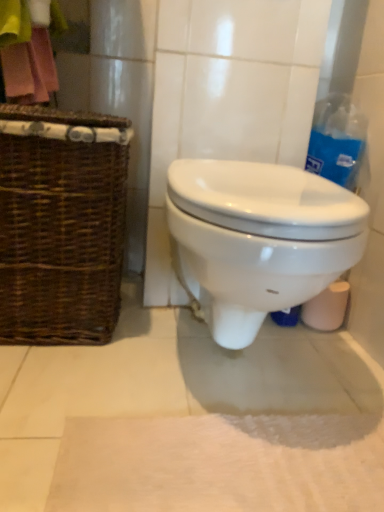
Question: Does brown woven picnic basket at left contain white soft bath mat at lower center?

Choices:
 (A) no
 (B) yes

Answer: (A)

Question: Is brown woven picnic basket at left thinner than white soft bath mat at lower center?

Choices:
 (A) yes
 (B) no

Answer: (B)

Question: Considering the relative sizes of brown woven picnic basket at left and white soft bath mat at lower center in the image provided, is brown woven picnic basket at left shorter than white soft bath mat at lower center?

Choices:
 (A) no
 (B) yes

Answer: (A)

Question: Is brown woven picnic basket at left facing towards white soft bath mat at lower center?

Choices:
 (A) yes
 (B) no

Answer: (B)

Question: Can you confirm if brown woven picnic basket at left is wider than white soft bath mat at lower center?

Choices:
 (A) yes
 (B) no

Answer: (A)

Question: Is pink fabric at upper left in front of or behind brown woven picnic basket at left in the image?

Choices:
 (A) behind
 (B) front

Answer: (A)

Question: Considering the positions of pink fabric at upper left and brown woven picnic basket at left in the image, is pink fabric at upper left wider or thinner than brown woven picnic basket at left?

Choices:
 (A) wide
 (B) thin

Answer: (B)

Question: Is pink fabric at upper left to the left or to the right of brown woven picnic basket at left in the image?

Choices:
 (A) right
 (B) left

Answer: (B)

Question: Considering the positions of point (13, 2) and point (59, 117), is point (13, 2) closer or farther from the camera than point (59, 117)?

Choices:
 (A) closer
 (B) farther

Answer: (B)

Question: From the image's perspective, is blue plastic bag at upper right positioned above or below white glossy toilet at center?

Choices:
 (A) below
 (B) above

Answer: (B)

Question: Considering the positions of blue plastic bag at upper right and white glossy toilet at center in the image, is blue plastic bag at upper right wider or thinner than white glossy toilet at center?

Choices:
 (A) thin
 (B) wide

Answer: (A)

Question: In the image, is blue plastic bag at upper right positioned in front of or behind white glossy toilet at center?

Choices:
 (A) behind
 (B) front

Answer: (A)

Question: Based on their sizes in the image, would you say blue plastic bag at upper right is bigger or smaller than white glossy toilet at center?

Choices:
 (A) small
 (B) big

Answer: (A)

Question: From a real-world perspective, relative to pink fabric at upper left, is white glossy toilet at center vertically above or below?

Choices:
 (A) above
 (B) below

Answer: (B)

Question: Considering the positions of white glossy toilet at center and pink fabric at upper left in the image, is white glossy toilet at center taller or shorter than pink fabric at upper left?

Choices:
 (A) short
 (B) tall

Answer: (B)